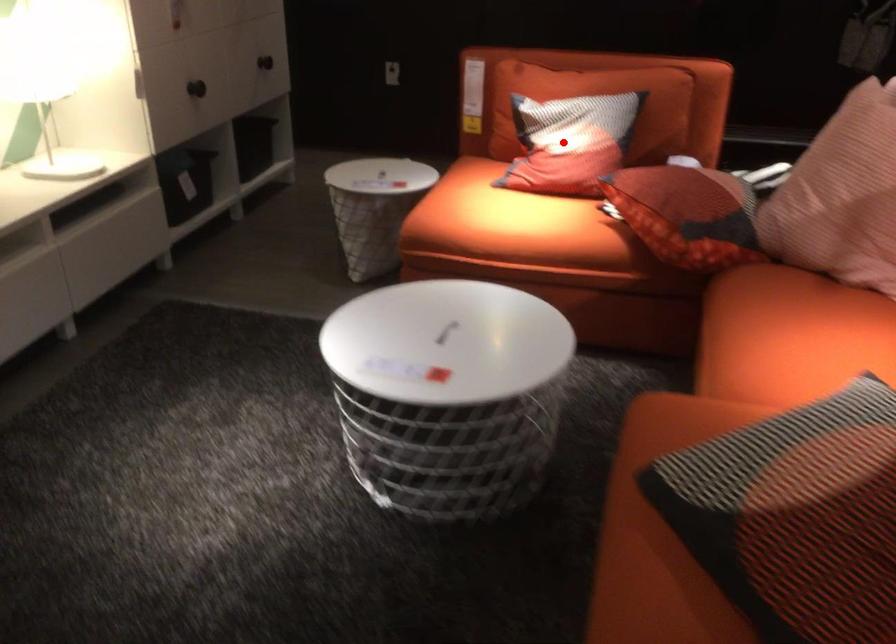
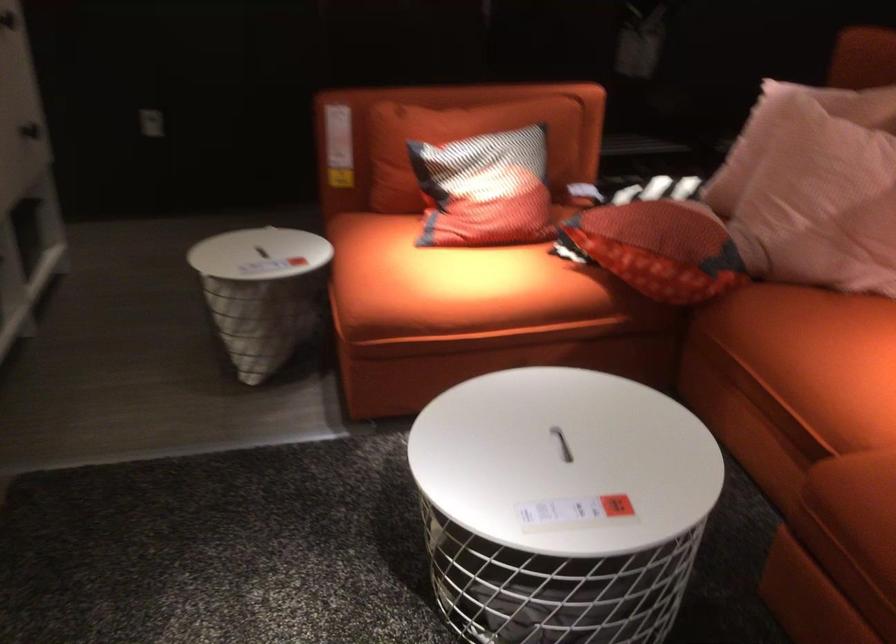
Find the pixel in the second image that matches the highlighted location in the first image.

(485, 190)